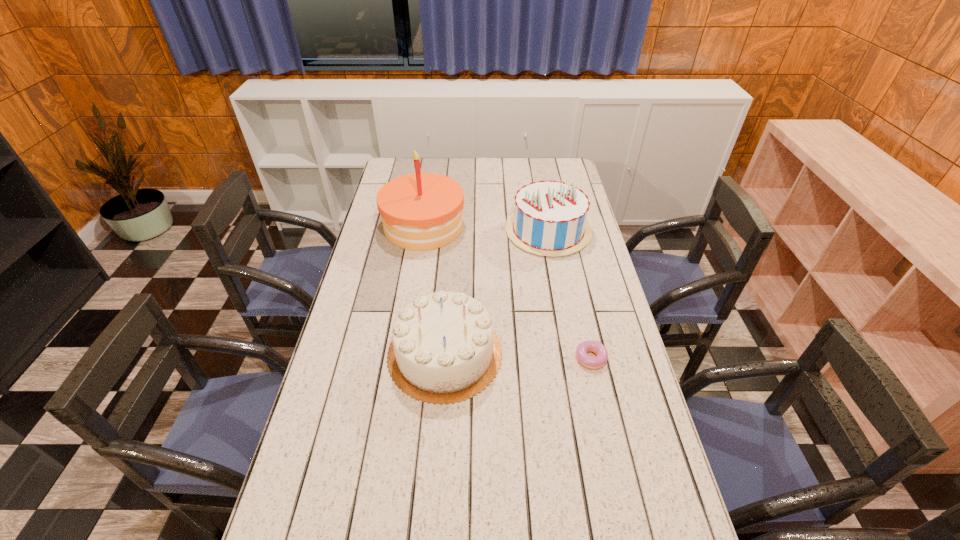
Locate an element on the screen. Image resolution: width=960 pixels, height=540 pixels. free space that satisfies the following two spatial constraints: 1. on the front side of the tallest object; 2. on the left side of the nearest birthday cake is located at coordinates (403, 354).

Find the location of `free spot that satisfies the following two spatial constraints: 1. on the front side of the tallest birthday cake; 2. on the right side of the shortest object`. free spot that satisfies the following two spatial constraints: 1. on the front side of the tallest birthday cake; 2. on the right side of the shortest object is located at coordinates coord(402,360).